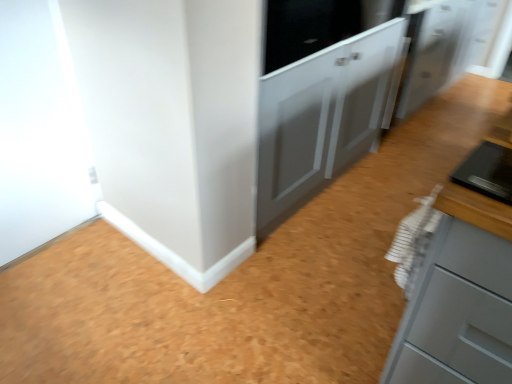
The width and height of the screenshot is (512, 384). What do you see at coordinates (321, 118) in the screenshot?
I see `matte gray cabinet at center` at bounding box center [321, 118].

Image resolution: width=512 pixels, height=384 pixels. Find the location of `matte gray cabinet at center`. matte gray cabinet at center is located at coordinates (321, 118).

I want to click on matte gray cabinet at center, so click(321, 118).